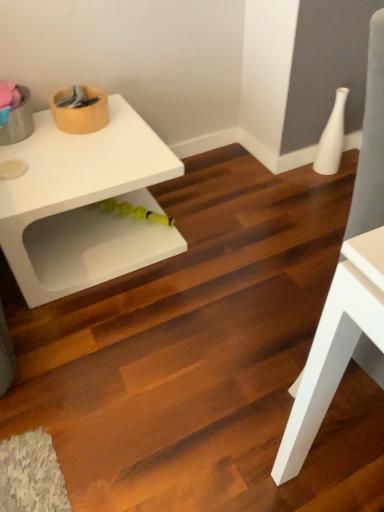
Find the location of `unoccupied space behind white matte table at right, placed as the first table when sorted from front to back`. unoccupied space behind white matte table at right, placed as the first table when sorted from front to back is located at coordinates (284, 308).